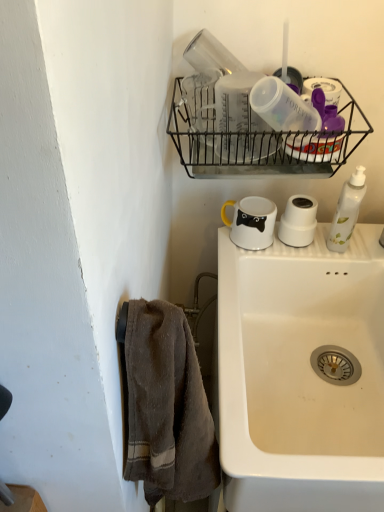
Measure the distance between white ceramic sink at lower right and camera.

The depth of white ceramic sink at lower right is 24.06 inches.

Identify the location of brown textured towel at left. (165, 405).

Identify the location of white glossy mug at upper center. pos(251,222).

The width and height of the screenshot is (384, 512). In order to click on black wire basket at upper center in this screenshot , I will do `click(255, 139)`.

Considering the relative positions of white glossy mug at upper center and white matte toilet paper at upper center in the image provided, is white glossy mug at upper center to the left or to the right of white matte toilet paper at upper center?

white glossy mug at upper center is positioned on white matte toilet paper at upper center's left side.

From the image's perspective, is white glossy mug at upper center located beneath white matte toilet paper at upper center?

Yes.

Is point (250, 204) positioned behind point (298, 200)?

That is True.

Who is bigger, white glossy mug at upper center or white matte toilet paper at upper center?

white glossy mug at upper center is bigger.

Are white plastic soap dispenser at right and white ceramic sink at lower right making contact?

There is a gap between white plastic soap dispenser at right and white ceramic sink at lower right.

Considering the sizes of white plastic soap dispenser at right and white ceramic sink at lower right in the image, is white plastic soap dispenser at right wider or thinner than white ceramic sink at lower right?

white plastic soap dispenser at right is thinner than white ceramic sink at lower right.

Is white plastic soap dispenser at right shorter than white ceramic sink at lower right?

Indeed, white plastic soap dispenser at right has a lesser height compared to white ceramic sink at lower right.

Is white plastic soap dispenser at right oriented towards white ceramic sink at lower right?

No, white plastic soap dispenser at right is not facing towards white ceramic sink at lower right.

Is black wire basket at upper center positioned behind white ceramic sink at lower right?

Yes, it is behind white ceramic sink at lower right.

Considering the positions of objects black wire basket at upper center and white ceramic sink at lower right in the image provided, who is more to the right, black wire basket at upper center or white ceramic sink at lower right?

Positioned to the right is white ceramic sink at lower right.

From the image's perspective, is black wire basket at upper center located above or below white ceramic sink at lower right?

Clearly, from the image's perspective, black wire basket at upper center is above white ceramic sink at lower right.

Locate an element on the screen. This screenshot has width=384, height=512. sink on the right of black wire basket at upper center is located at coordinates (300, 374).

Does black wire basket at upper center have a greater width compared to white plastic soap dispenser at right?

Correct, the width of black wire basket at upper center exceeds that of white plastic soap dispenser at right.

Considering the sizes of objects black wire basket at upper center and white plastic soap dispenser at right in the image provided, who is smaller, black wire basket at upper center or white plastic soap dispenser at right?

With smaller size is white plastic soap dispenser at right.

Based on the photo, is black wire basket at upper center to the right of white plastic soap dispenser at right from the viewer's perspective?

In fact, black wire basket at upper center is to the left of white plastic soap dispenser at right.

From the image's perspective, who appears lower, black wire basket at upper center or white plastic soap dispenser at right?

white plastic soap dispenser at right, from the image's perspective.

Can we say white plastic soap dispenser at right lies outside brown textured towel at left?

Yes, white plastic soap dispenser at right is not within brown textured towel at left.

From a real-world perspective, which object stands above the other?

From a 3D spatial view, white plastic soap dispenser at right is above.

Who is shorter, white plastic soap dispenser at right or brown textured towel at left?

With less height is white plastic soap dispenser at right.

In terms of size, does brown textured towel at left appear bigger or smaller than black wire basket at upper center?

Clearly, brown textured towel at left is smaller in size than black wire basket at upper center.

Does brown textured towel at left appear on the left side of black wire basket at upper center?

Yes.

Are brown textured towel at left and black wire basket at upper center far apart?

That's not correct — brown textured towel at left is a little close to black wire basket at upper center.

Does black wire basket at upper center have a greater height compared to brown textured towel at left?

No, black wire basket at upper center is not taller than brown textured towel at left.

Measure the distance between black wire basket at upper center and brown textured towel at left.

black wire basket at upper center is 22.11 inches away from brown textured towel at left.

Based on their sizes in the image, would you say black wire basket at upper center is bigger or smaller than brown textured towel at left?

In the image, black wire basket at upper center appears to be larger than brown textured towel at left.

Is the surface of black wire basket at upper center in direct contact with brown textured towel at left?

black wire basket at upper center and brown textured towel at left are not in contact.

I want to click on toilet paper above the white glossy mug at upper center (from a real-world perspective), so click(298, 221).

Where is `soap dispenser behind the white ceramic sink at lower right`? soap dispenser behind the white ceramic sink at lower right is located at coordinates (347, 211).

Based on their spatial positions, is brown textured towel at left or black wire basket at upper center further from white glossy mug at upper center?

brown textured towel at left lies further to white glossy mug at upper center than the other object.

Which object lies nearer to the anchor point white matte toilet paper at upper center, white ceramic sink at lower right or brown textured towel at left?

Based on the image, white ceramic sink at lower right appears to be nearer to white matte toilet paper at upper center.

From the image, which object appears to be farther from white plastic soap dispenser at right, white glossy mug at upper center or white matte toilet paper at upper center?

Among the two, white glossy mug at upper center is located further to white plastic soap dispenser at right.

From the image, which object appears to be nearer to white matte toilet paper at upper center, white plastic soap dispenser at right or black wire basket at upper center?

white plastic soap dispenser at right is closer to white matte toilet paper at upper center.

Based on their spatial positions, is white plastic soap dispenser at right or black wire basket at upper center closer to white ceramic sink at lower right?

white plastic soap dispenser at right is closer to white ceramic sink at lower right.

Looking at the image, which one is located closer to white plastic soap dispenser at right, brown textured towel at left or black wire basket at upper center?

The object closer to white plastic soap dispenser at right is black wire basket at upper center.

Based on their spatial positions, is white matte toilet paper at upper center or white plastic soap dispenser at right closer to white glossy mug at upper center?

Based on the image, white matte toilet paper at upper center appears to be nearer to white glossy mug at upper center.

Looking at the image, which one is located further to brown textured towel at left, white matte toilet paper at upper center or white plastic soap dispenser at right?

The object further to brown textured towel at left is white plastic soap dispenser at right.

What are the coordinates of `soap dispenser between black wire basket at upper center and brown textured towel at left vertically` in the screenshot? It's located at (347, 211).

Find the location of a particular element. toilet paper between black wire basket at upper center and white ceramic sink at lower right in the vertical direction is located at coordinates (298, 221).

Identify the location of toilet paper between black wire basket at upper center and white glossy mug at upper center vertically. Image resolution: width=384 pixels, height=512 pixels. (298, 221).

This screenshot has width=384, height=512. What are the coordinates of `soap dispenser located between white ceramic sink at lower right and white matte toilet paper at upper center in the depth direction` in the screenshot? It's located at (347, 211).